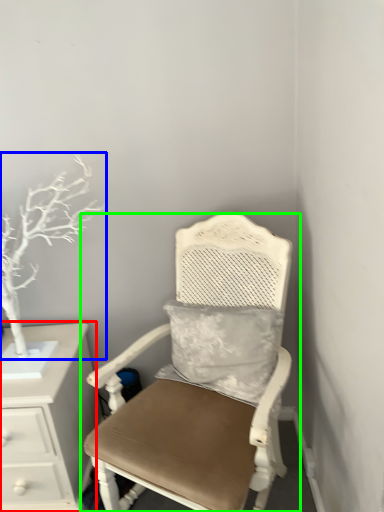
Question: Which is nearer to the chest of drawers (highlighted by a red box)? tree (highlighted by a blue box) or chair (highlighted by a green box).

Choices:
 (A) tree
 (B) chair

Answer: (A)